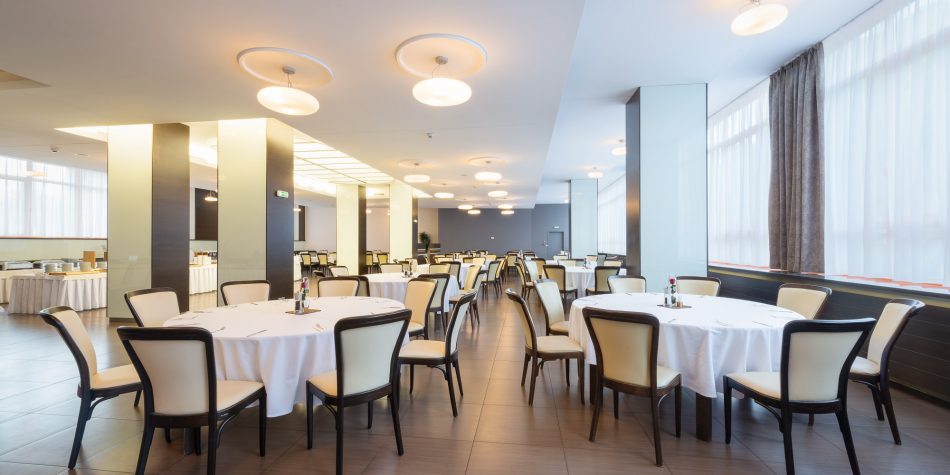
Identify the location of pillars. (146, 215), (249, 200), (347, 218), (401, 216), (584, 212), (673, 208).